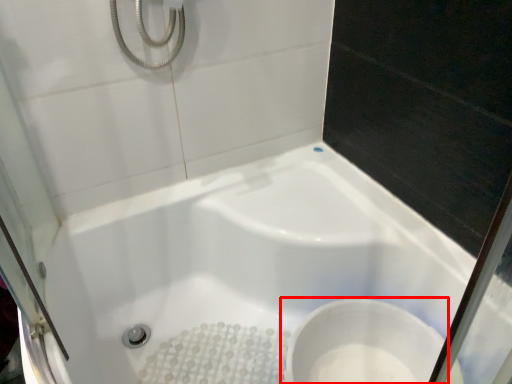
Question: From the image's perspective, what is the correct spatial positioning of toilet (annotated by the red box) in reference to bathtub?

Choices:
 (A) below
 (B) above

Answer: (A)